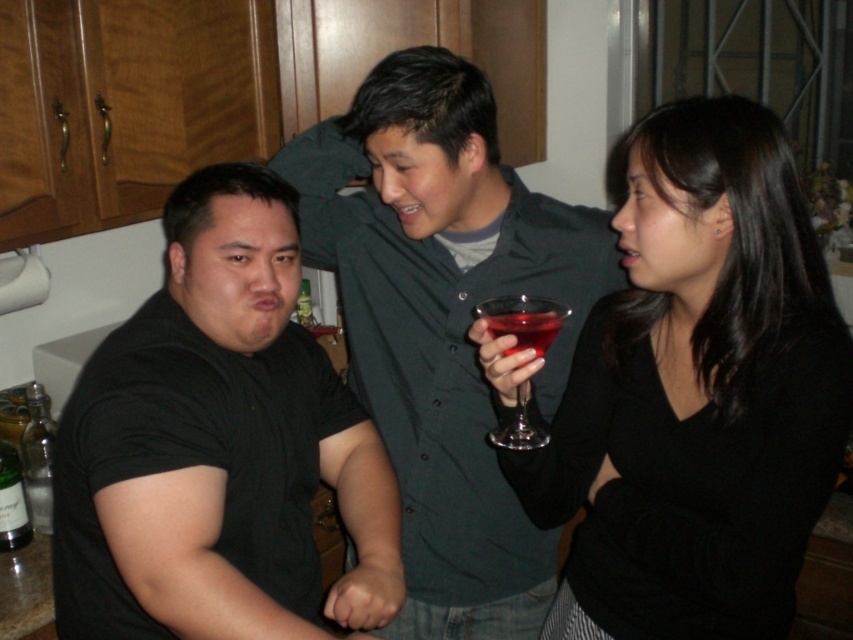
Does translucent glass wine glass at center appear over translucent glass at center?

Incorrect, translucent glass wine glass at center is not positioned above translucent glass at center.

Is translucent glass wine glass at center to the right of translucent glass at center from the viewer's perspective?

Incorrect, translucent glass wine glass at center is not on the right side of translucent glass at center.

Image resolution: width=853 pixels, height=640 pixels. Describe the element at coordinates (523, 321) in the screenshot. I see `translucent glass wine glass at center` at that location.

In order to click on translucent glass wine glass at center in this screenshot , I will do `click(523, 321)`.

Between black matte shirt at left and translucent glass wine glass at center, which one is positioned lower?

Positioned lower is black matte shirt at left.

Does black matte shirt at left appear over translucent glass wine glass at center?

Incorrect, black matte shirt at left is not positioned above translucent glass wine glass at center.

Who is more distant from viewer, [367,618] or [543,308]?

Point [543,308]

The image size is (853, 640). What are the coordinates of `black matte shirt at left` in the screenshot? It's located at (218, 445).

Who is taller, matte gray shirt at center or translucent glass at center?

matte gray shirt at center is taller.

Find the location of `matte gray shirt at center`. matte gray shirt at center is located at coordinates (444, 321).